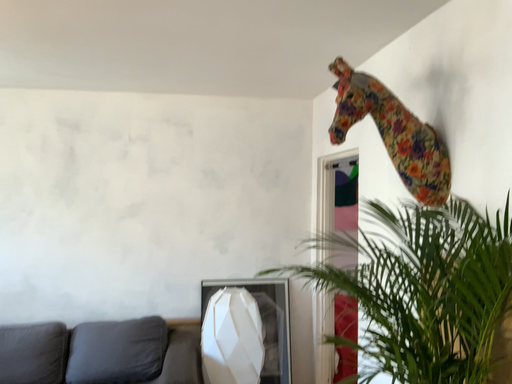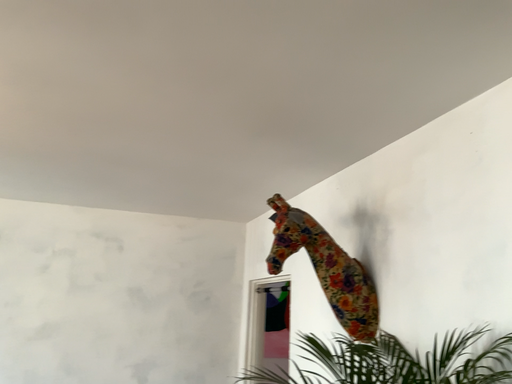
Question: Which way did the camera rotate in the video?

Choices:
 (A) rotated upward
 (B) rotated downward

Answer: (A)